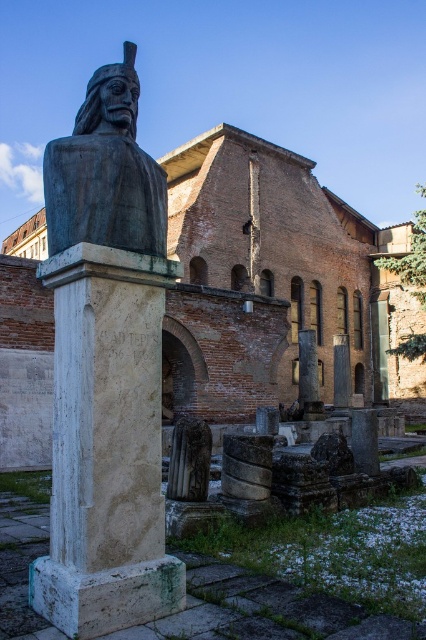
From the picture: You are an archaeologist standing in front of the brick wall at center and the white marble column at center. Which structure is closer to you?

The brick wall at center is closer to you because it is positioned further to the viewer than the white marble column at center.